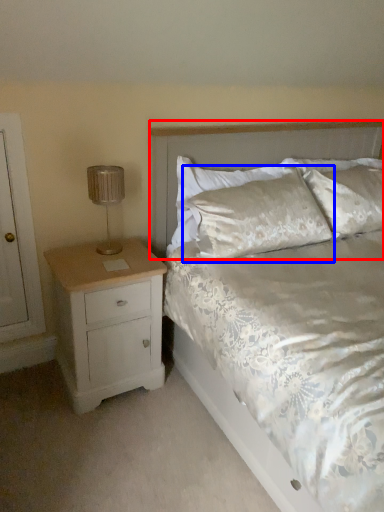
Question: Among these objects, which one is farthest to the camera, headboard (highlighted by a red box) or pillow (highlighted by a blue box)?

Choices:
 (A) headboard
 (B) pillow

Answer: (B)